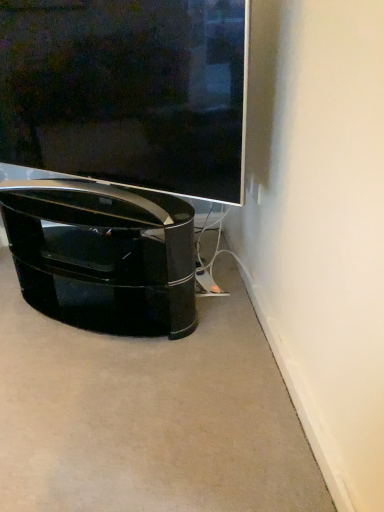
Question: From the image's perspective, is glossy black tv stand at lower left above or below matte black tv at center?

Choices:
 (A) above
 (B) below

Answer: (B)

Question: Considering the positions of point (114, 239) and point (6, 82), is point (114, 239) closer or farther from the camera than point (6, 82)?

Choices:
 (A) closer
 (B) farther

Answer: (B)

Question: Considering the positions of glossy black tv stand at lower left and matte black tv at center in the image, is glossy black tv stand at lower left wider or thinner than matte black tv at center?

Choices:
 (A) thin
 (B) wide

Answer: (B)

Question: From the image's perspective, relative to glossy black tv stand at lower left, is matte black tv at center above or below?

Choices:
 (A) below
 (B) above

Answer: (B)

Question: In terms of height, does matte black tv at center look taller or shorter compared to glossy black tv stand at lower left?

Choices:
 (A) tall
 (B) short

Answer: (A)

Question: Based on their sizes in the image, would you say matte black tv at center is bigger or smaller than glossy black tv stand at lower left?

Choices:
 (A) small
 (B) big

Answer: (A)

Question: In the image, is matte black tv at center positioned in front of or behind glossy black tv stand at lower left?

Choices:
 (A) front
 (B) behind

Answer: (A)